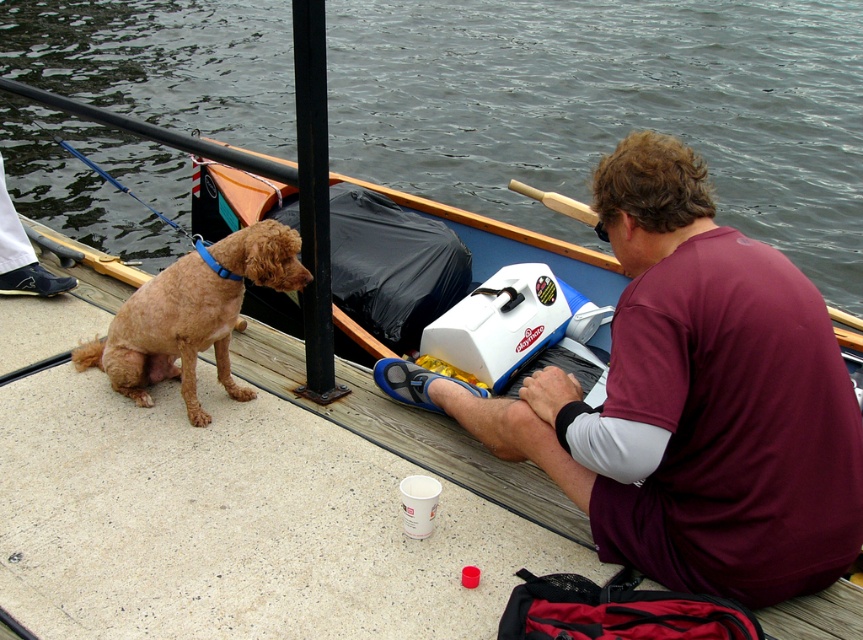
Between maroon fabric shirt at center and shiny brown fur at left, which one is positioned higher?

shiny brown fur at left

Who is more distant from viewer, (656,342) or (216,360)?

Point (216,360)

Locate an element on the screen. maroon fabric shirt at center is located at coordinates coord(691,401).

Is smooth concrete dock at center closer to the viewer compared to black metal pole at center?

Yes.

Who is more forward, (x=232, y=362) or (x=298, y=145)?

Point (x=298, y=145)

Find the location of a particular element. This screenshot has width=863, height=640. smooth concrete dock at center is located at coordinates (307, 513).

Does maroon fabric shirt at center have a larger size compared to smooth concrete dock at center?

No, maroon fabric shirt at center is not bigger than smooth concrete dock at center.

Who is positioned more to the right, maroon fabric shirt at center or smooth concrete dock at center?

maroon fabric shirt at center is more to the right.

Between point (630, 493) and point (77, 522), which one is positioned in front?

Point (630, 493)

Where is `maroon fabric shirt at center`? Image resolution: width=863 pixels, height=640 pixels. maroon fabric shirt at center is located at coordinates (691, 401).